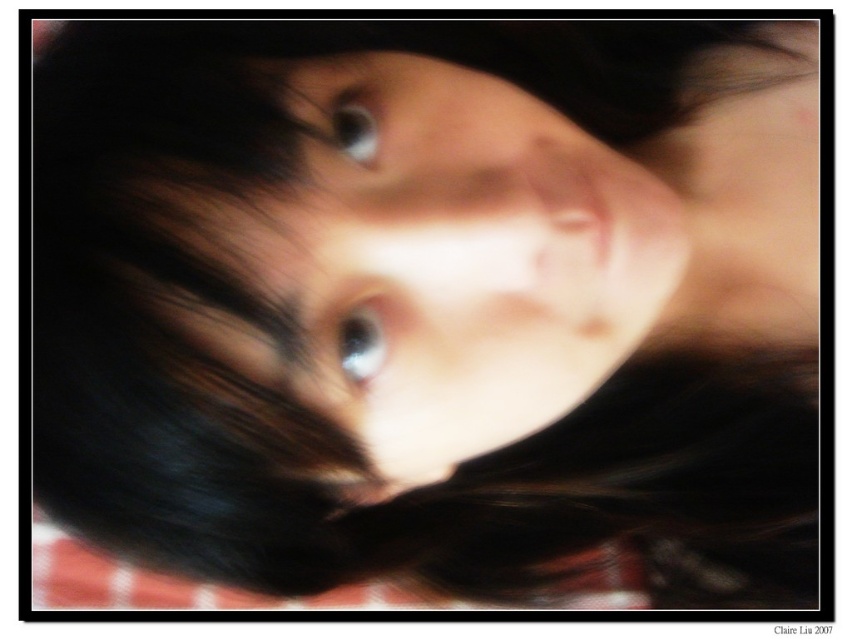
Question: Does shiny blue eye at center appear on the right side of blue glossy eye at center?

Choices:
 (A) no
 (B) yes

Answer: (B)

Question: Does shiny blue eye at center come in front of blue glossy eye at center?

Choices:
 (A) no
 (B) yes

Answer: (B)

Question: Which object is farther from the camera taking this photo?

Choices:
 (A) blue glossy eye at center
 (B) shiny blue eye at center

Answer: (A)

Question: Does shiny blue eye at center lie behind blue glossy eye at center?

Choices:
 (A) no
 (B) yes

Answer: (A)

Question: Among these objects, which one is nearest to the camera?

Choices:
 (A) blue glossy eye at center
 (B) shiny blue eye at center

Answer: (B)

Question: Which object is closer to the camera taking this photo?

Choices:
 (A) shiny blue eye at center
 (B) blue glossy eye at center

Answer: (A)